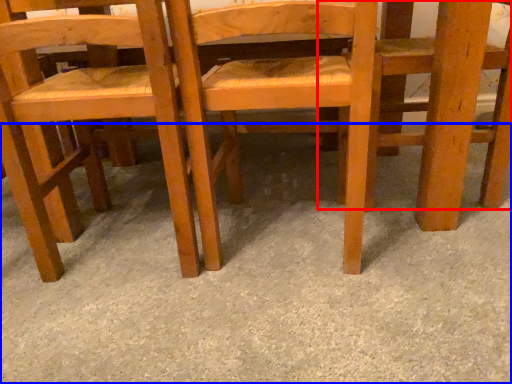
Question: Which object is further to the camera taking this photo, chair (highlighted by a red box) or concrete (highlighted by a blue box)?

Choices:
 (A) chair
 (B) concrete

Answer: (A)